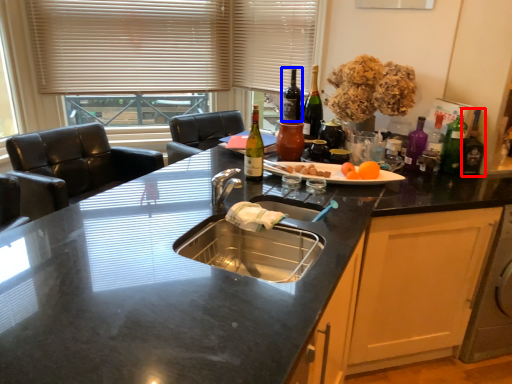
Question: Which of the following is the farthest to the observer, bottle (highlighted by a red box) or bottle (highlighted by a blue box)?

Choices:
 (A) bottle
 (B) bottle

Answer: (B)